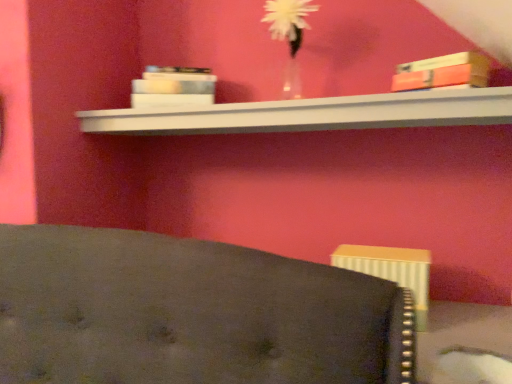
Question: Should I look upward or downward to see white matte book at upper center, arranged as the 2th book when viewed from the front?

Choices:
 (A) up
 (B) down

Answer: (A)

Question: Would you say white matte book at upper center, which is the 2th book from right to left, contains translucent glass vase at upper center?

Choices:
 (A) no
 (B) yes

Answer: (A)

Question: Does white matte book at upper center, arranged as the 2th book when viewed from the front, have a lesser width compared to translucent glass vase at upper center?

Choices:
 (A) no
 (B) yes

Answer: (B)

Question: Are white matte book at upper center, which is the 2th book from right to left, and translucent glass vase at upper center located far from each other?

Choices:
 (A) yes
 (B) no

Answer: (B)

Question: Is white matte book at upper center, arranged as the 2th book when viewed from the front, outside translucent glass vase at upper center?

Choices:
 (A) no
 (B) yes

Answer: (B)

Question: Can you confirm if white matte book at upper center, arranged as the 2th book when viewed from the front, is smaller than translucent glass vase at upper center?

Choices:
 (A) yes
 (B) no

Answer: (A)

Question: Is the depth of white matte book at upper center, the first book from the back, greater than that of translucent glass vase at upper center?

Choices:
 (A) no
 (B) yes

Answer: (B)

Question: Considering the relative positions of matte orange book at upper right, acting as the 2th book starting from the back, and white glossy shelf at upper center in the image provided, is matte orange book at upper right, acting as the 2th book starting from the back, to the right of white glossy shelf at upper center from the viewer's perspective?

Choices:
 (A) yes
 (B) no

Answer: (A)

Question: Can white glossy shelf at upper center be found inside matte orange book at upper right, which is counted as the 1th book, starting from the front?

Choices:
 (A) no
 (B) yes

Answer: (A)

Question: Would you consider matte orange book at upper right, which is the second book in left-to-right order, to be distant from white glossy shelf at upper center?

Choices:
 (A) yes
 (B) no

Answer: (B)

Question: Can you confirm if matte orange book at upper right, which is the second book in left-to-right order, is bigger than white glossy shelf at upper center?

Choices:
 (A) no
 (B) yes

Answer: (A)

Question: Is matte orange book at upper right, which is the second book in left-to-right order, positioned with its back to white glossy shelf at upper center?

Choices:
 (A) yes
 (B) no

Answer: (B)

Question: Is matte orange book at upper right, which is counted as the 1th book, starting from the front, to the left of white glossy shelf at upper center from the viewer's perspective?

Choices:
 (A) no
 (B) yes

Answer: (A)

Question: Would you say white matte book at upper center, acting as the first book starting from the left, is part of translucent glass vase at upper center's contents?

Choices:
 (A) no
 (B) yes

Answer: (A)